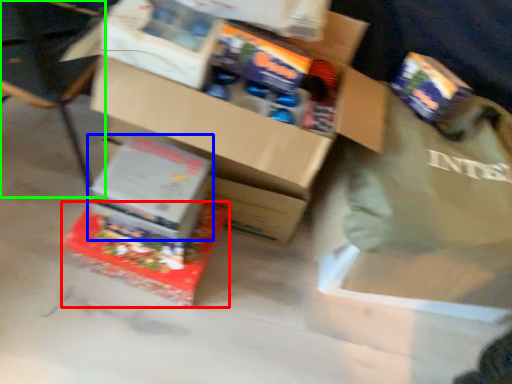
Question: Which object is the closest to the box (highlighted by a red box)? Choose among these: box (highlighted by a blue box) or chair (highlighted by a green box).

Choices:
 (A) box
 (B) chair

Answer: (A)